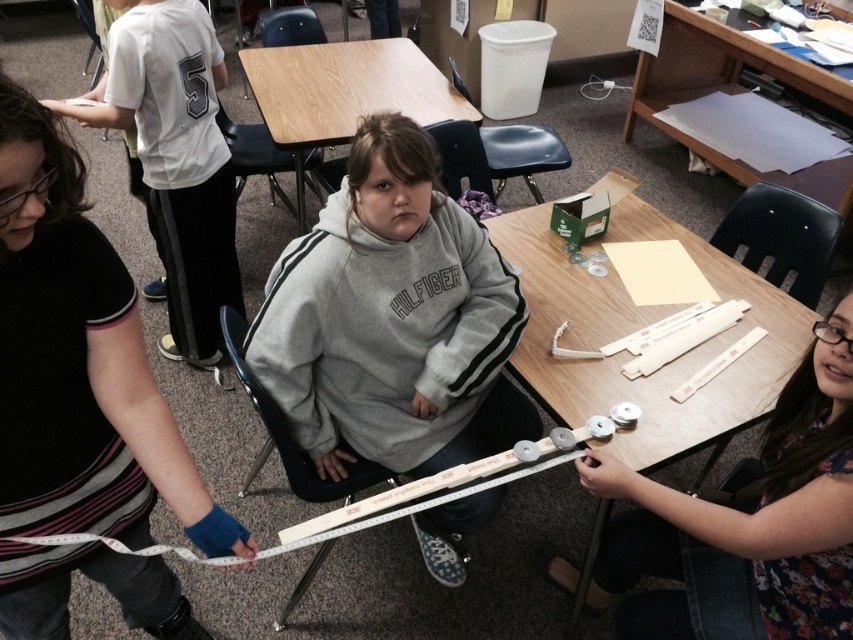
Consider the image. Does white cotton shirt at upper left have a smaller size compared to wooden table at upper right?

Indeed, white cotton shirt at upper left has a smaller size compared to wooden table at upper right.

Measure the distance between white cotton shirt at upper left and camera.

They are 1.75 meters apart.

The image size is (853, 640). I want to click on white cotton shirt at upper left, so click(x=177, y=160).

Find the location of a particular element. white cotton shirt at upper left is located at coordinates (177, 160).

Is white cotton shirt at upper left to the left of wooden table at center from the viewer's perspective?

Correct, you'll find white cotton shirt at upper left to the left of wooden table at center.

Who is more forward, (202, 236) or (457, 100)?

Point (202, 236) is in front.

At what (x,y) coordinates should I click in order to perform the action: click on white cotton shirt at upper left. Please return your answer as a coordinate pair (x, y). The width and height of the screenshot is (853, 640). Looking at the image, I should click on (177, 160).

How much distance is there between gray fleece sweatshirt at center and white plastic ruler at lower right?

gray fleece sweatshirt at center is 22.20 inches from white plastic ruler at lower right.

This screenshot has width=853, height=640. In order to click on gray fleece sweatshirt at center in this screenshot , I will do `click(392, 321)`.